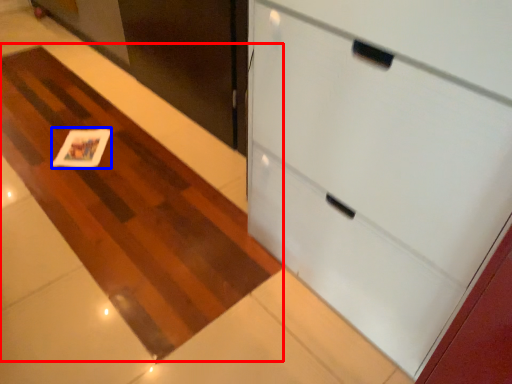
Question: Which object is closer to the camera taking this photo, plain (highlighted by a red box) or card (highlighted by a blue box)?

Choices:
 (A) plain
 (B) card

Answer: (A)